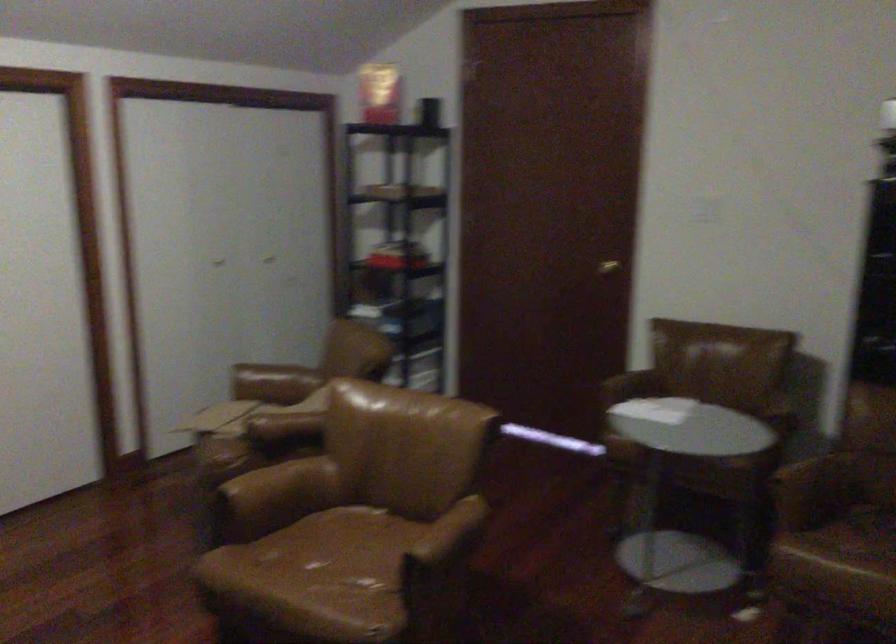
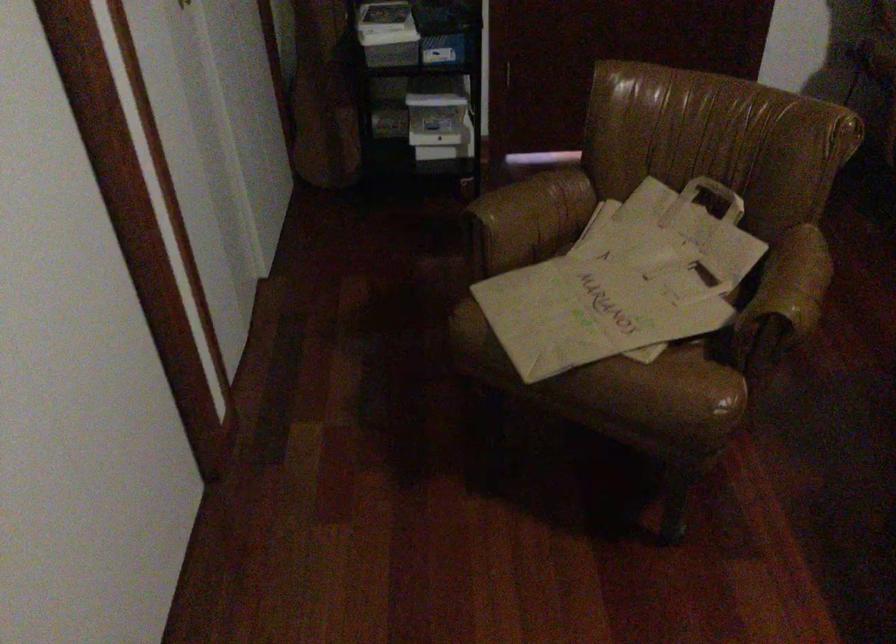
The point at (302, 419) is marked in the first image. Where is the corresponding point in the second image?

(803, 275)